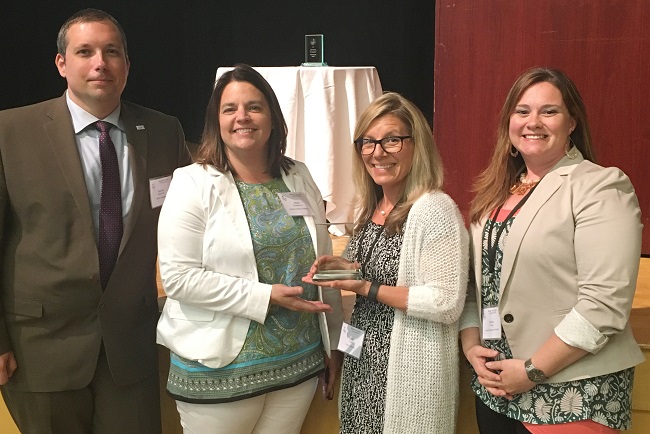
Locate an element on the screen. The image size is (650, 434). tablecloth is located at coordinates (309, 92).